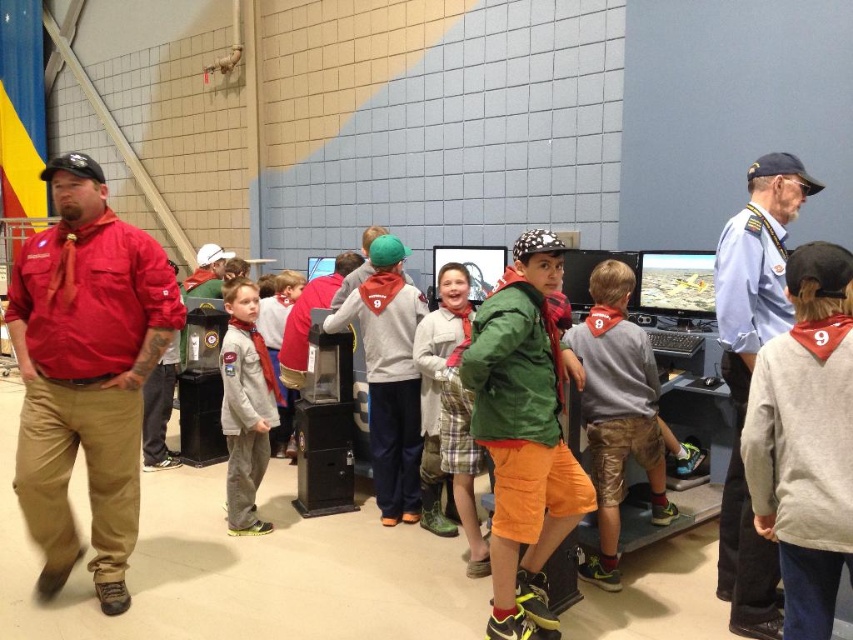
Question: Which object is positioned closest to the red cotton shirt at left?

Choices:
 (A) gray sweatshirt at center
 (B) green fabric shirt at center
 (C) light blue uniform at center
 (D) light gray fleece jacket at center

Answer: (B)

Question: Is red cotton shirt at left above green fabric shirt at center?

Choices:
 (A) yes
 (B) no

Answer: (A)

Question: Can you confirm if red cotton shirt at left is thinner than gray sweatshirt at center?

Choices:
 (A) yes
 (B) no

Answer: (B)

Question: Which object is closer to the camera taking this photo?

Choices:
 (A) gray sweatshirt at center
 (B) green fabric shirt at center
 (C) gray fleece hoodie at center
 (D) gray fleece sweatshirt at center

Answer: (A)

Question: Which object is the farthest from the light blue uniform at center?

Choices:
 (A) gray fleece sweatshirt at center
 (B) gray sweatshirt at center

Answer: (A)

Question: Where is red cotton shirt at left located in relation to gray fleece sweatshirt at center in the image?

Choices:
 (A) left
 (B) right

Answer: (A)